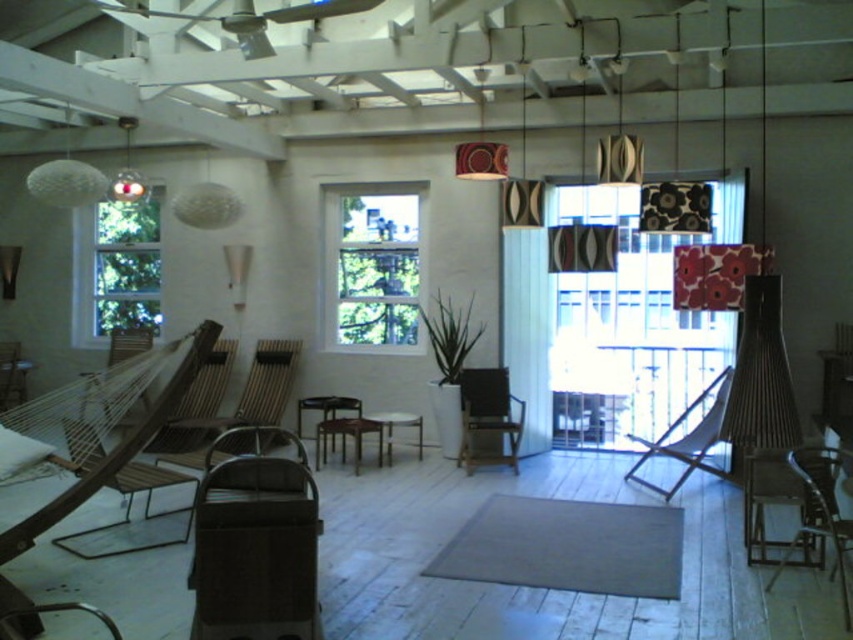
You are sitting in the wooden armchair at lower right and want to move to the wooden armchair at left. In which direction should you move to reach it?

You should move to the left to reach the wooden armchair at left since the wooden armchair at lower right is positioned to the right of the wooden armchair at left.

You are a delivery person trying to bring a large package through the transparent glass door at center. The wooden slatted chair at left is blocking your path. Can you move the chair to the side to access the door?

The transparent glass door at center is larger in size than wooden slatted chair at left, so you can move the wooden slatted chair at left out of the way to access the door since it is smaller than the door.

From the picture: You are trying to place a 6 feet long sofa between the wooden slatted chair at left and the wooden armchair at left. Can you fit it there?

The distance between the wooden slatted chair at left and the wooden armchair at left is 6.16 feet, so the 6 feet long sofa can fit there since it is shorter than the available space.